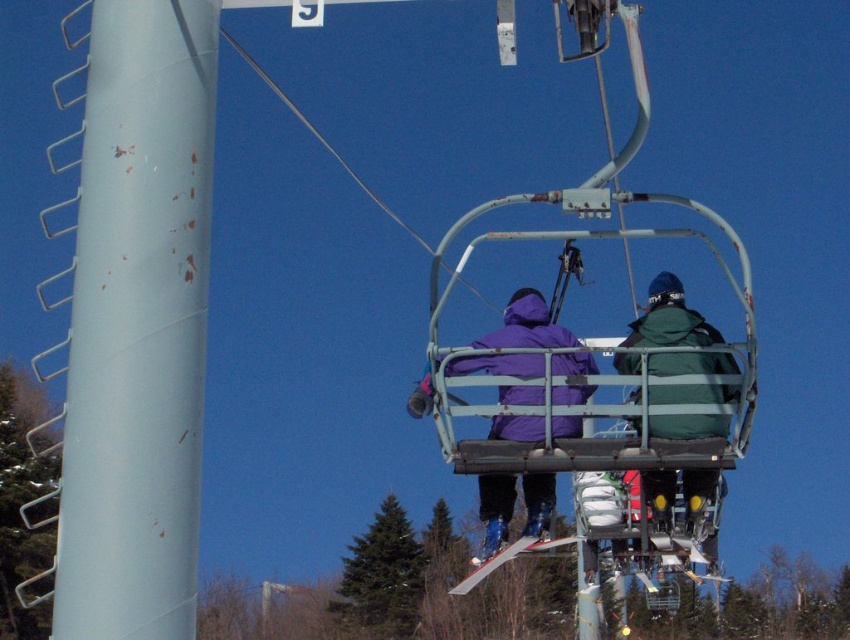
You are a ski instructor observing the scene. You notice the light blue plastic pole at left and the white plastic ski at center. Which object is positioned higher in the image?

The light blue plastic pole at left is positioned higher than the white plastic ski at center according to the description.

You are a photographer standing at the base of the ski lift and want to take a photo of the green matte jacket at center and the white plastic ski at center. Which object will appear larger in your photo?

The green matte jacket at center will appear larger in the photo because it is closer to the viewer than the white plastic ski at center.